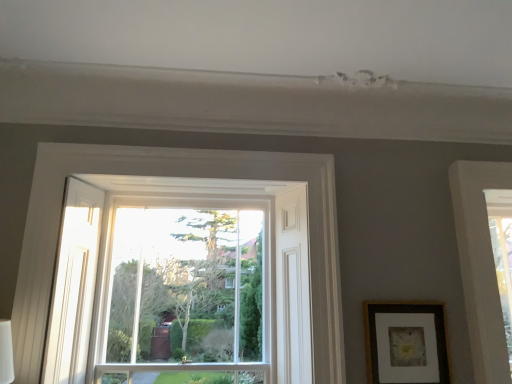
Describe the element at coordinates (185, 288) in the screenshot. I see `clear glass window at center` at that location.

The image size is (512, 384). I want to click on clear glass window at center, so click(185, 288).

What do you see at coordinates (406, 344) in the screenshot? I see `matte brown picture frame at right` at bounding box center [406, 344].

Locate an element on the screen. matte brown picture frame at right is located at coordinates (406, 344).

The width and height of the screenshot is (512, 384). I want to click on clear glass window at center, so click(185, 288).

Looking at this image, considering the relative positions of matte brown picture frame at right and clear glass window at center in the image provided, is matte brown picture frame at right to the left or to the right of clear glass window at center?

matte brown picture frame at right is to the right of clear glass window at center.

Which is in front, matte brown picture frame at right or clear glass window at center?

Positioned in front is matte brown picture frame at right.

Which is behind, point (378, 373) or point (103, 360)?

The point (103, 360) is more distant.

From the image's perspective, which is above, matte brown picture frame at right or clear glass window at center?

clear glass window at center.

From a real-world perspective, which is physically below, matte brown picture frame at right or clear glass window at center?

In real-world perspective, matte brown picture frame at right is lower.

Is matte brown picture frame at right wider than clear glass window at center?

No.

In terms of height, does matte brown picture frame at right look taller or shorter compared to clear glass window at center?

Considering their sizes, matte brown picture frame at right has less height than clear glass window at center.

Can you confirm if matte brown picture frame at right is smaller than clear glass window at center?

Correct, matte brown picture frame at right occupies less space than clear glass window at center.

Is clear glass window at center located within matte brown picture frame at right?

Definitely not — clear glass window at center is not inside matte brown picture frame at right.

Is matte brown picture frame at right directly adjacent to clear glass window at center?

No, matte brown picture frame at right is not with clear glass window at center.

Is matte brown picture frame at right looking in the opposite direction of clear glass window at center?

No, matte brown picture frame at right is not facing away from clear glass window at center.

What's the angular difference between matte brown picture frame at right and clear glass window at center's facing directions?

0.00294 degrees.

The height and width of the screenshot is (384, 512). What are the coordinates of `bay window above the matte brown picture frame at right (from the image's perspective)` in the screenshot? It's located at (185, 288).

Between clear glass window at center and matte brown picture frame at right, which one appears on the left side from the viewer's perspective?

From the viewer's perspective, clear glass window at center appears more on the left side.

In the image, is clear glass window at center positioned in front of or behind matte brown picture frame at right?

clear glass window at center is positioned farther from the viewer than matte brown picture frame at right.

Which is behind, point (136, 317) or point (379, 374)?

Point (136, 317)

From the picture: From the image's perspective, is clear glass window at center above or below matte brown picture frame at right?

clear glass window at center is situated higher than matte brown picture frame at right in the image.

From a real-world perspective, is clear glass window at center positioned under matte brown picture frame at right based on gravity?

No, from a real-world perspective, clear glass window at center is not under matte brown picture frame at right.

In the scene shown: Does clear glass window at center have a greater width compared to matte brown picture frame at right?

Yes, clear glass window at center is wider than matte brown picture frame at right.

Does clear glass window at center have a lesser height compared to matte brown picture frame at right?

No.

Looking at the image, does clear glass window at center seem bigger or smaller compared to matte brown picture frame at right?

In the image, clear glass window at center appears to be larger than matte brown picture frame at right.

Would you say clear glass window at center is inside or outside matte brown picture frame at right?

The correct answer is: outside.

Is clear glass window at center beside matte brown picture frame at right?

No, clear glass window at center is not in contact with matte brown picture frame at right.

Could you tell me if clear glass window at center is facing matte brown picture frame at right?

No.

How different are the orientations of clear glass window at center and matte brown picture frame at right in degrees?

The angle between the facing direction of clear glass window at center and the facing direction of matte brown picture frame at right is 0.00294 degrees.

How much distance is there between clear glass window at center and matte brown picture frame at right?

clear glass window at center is 38.57 inches from matte brown picture frame at right.

This screenshot has height=384, width=512. I want to click on picture frame directly beneath the clear glass window at center (from a real-world perspective), so (406, 344).

At what (x,y) coordinates should I click in order to perform the action: click on picture frame below the clear glass window at center (from the image's perspective). Please return your answer as a coordinate pair (x, y). Looking at the image, I should click on (406, 344).

Locate an element on the screen. bay window behind the matte brown picture frame at right is located at coordinates (185, 288).